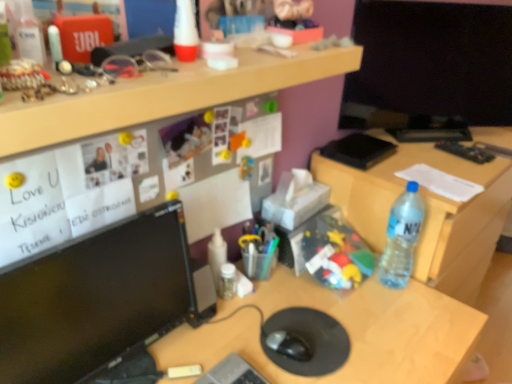
Where is `vacant space situated above black matte notepad at upper right (from a real-world perspective)`? vacant space situated above black matte notepad at upper right (from a real-world perspective) is located at coordinates (360, 140).